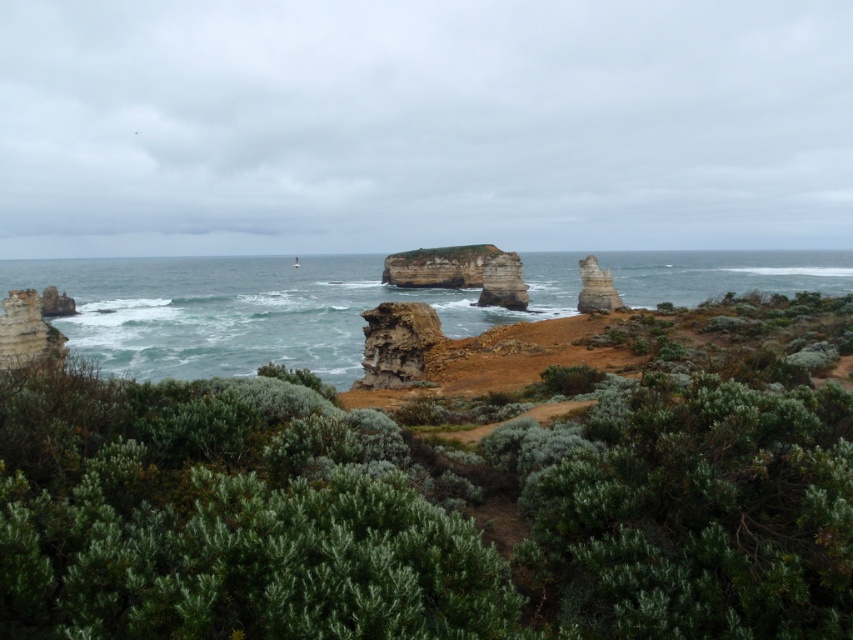
What do you see at coordinates (461, 273) in the screenshot? I see `rusty stone arch at center` at bounding box center [461, 273].

Does rusty stone arch at center have a lesser height compared to smooth gray rock at upper right?

No.

Is point (480, 273) positioned after point (585, 273)?

Yes, point (480, 273) is behind point (585, 273).

Where is `rusty stone arch at center`? The height and width of the screenshot is (640, 853). rusty stone arch at center is located at coordinates (461, 273).

Between green shrubbery at center and greenish-blue water at center, which one is positioned higher?

Positioned higher is greenish-blue water at center.

How far apart are green shrubbery at center and greenish-blue water at center?

The distance of green shrubbery at center from greenish-blue water at center is 561.62 feet.

Is point (450, 609) closer to viewer compared to point (825, 282)?

Yes, point (450, 609) is in front of point (825, 282).

You are a GUI agent. You are given a task and a screenshot of the screen. Output one action in this format:
    pyautogui.click(x=<x>, y=<y>)
    Task: Click on the green shrubbery at center
    Image resolution: width=853 pixels, height=640 pixels.
    Given the screenshot: What is the action you would take?
    pyautogui.click(x=448, y=490)

Which is more to the right, rusty stone rock at center or smooth gray rock at upper right?

smooth gray rock at upper right is more to the right.

Image resolution: width=853 pixels, height=640 pixels. Describe the element at coordinates (396, 342) in the screenshot. I see `rusty stone rock at center` at that location.

What are the coordinates of `rusty stone rock at center` in the screenshot? It's located at (396, 342).